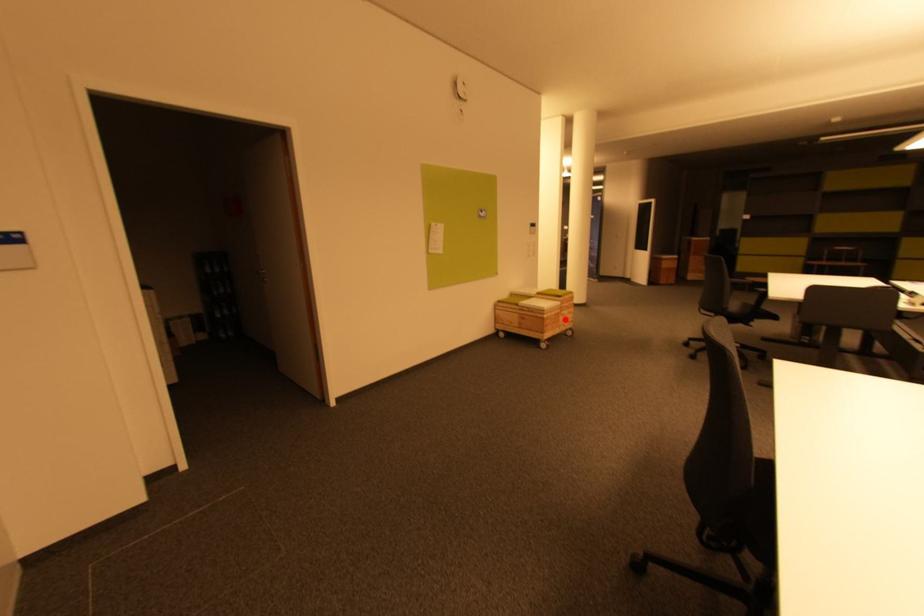
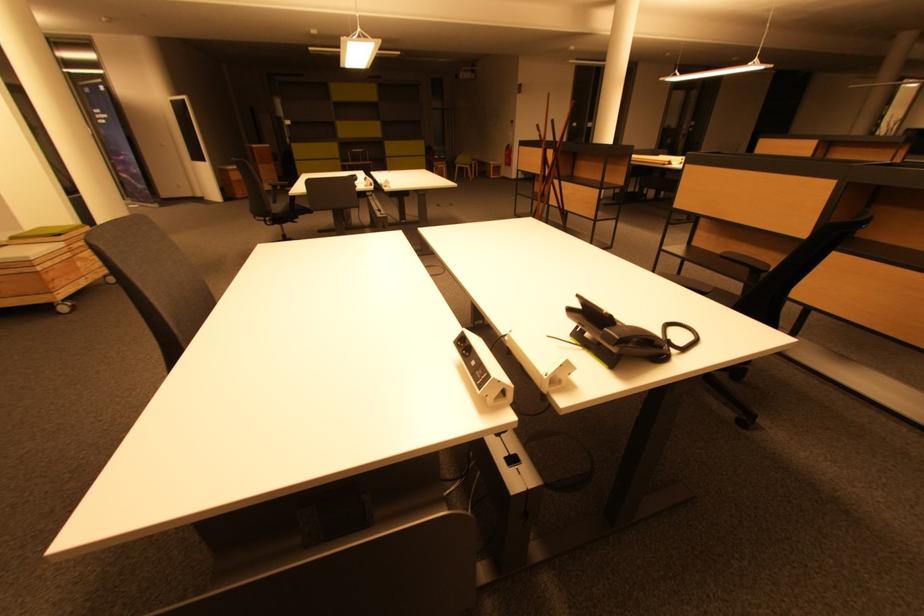
Where in the second image is the point corresponding to the highlighted location from the first image?

(83, 265)